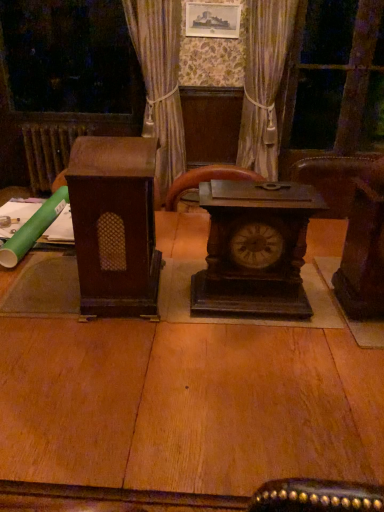
Identify the location of free space to the left of brown wood speaker at left, the 1th furniture viewed from the left. Image resolution: width=384 pixels, height=512 pixels. (41, 287).